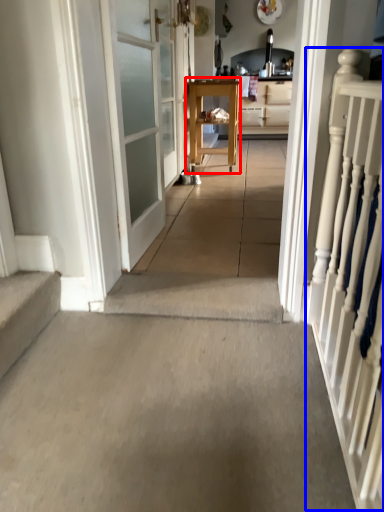
Question: Which object appears closest to the camera in this image, furniture (highlighted by a red box) or rail (highlighted by a blue box)?

Choices:
 (A) furniture
 (B) rail

Answer: (B)